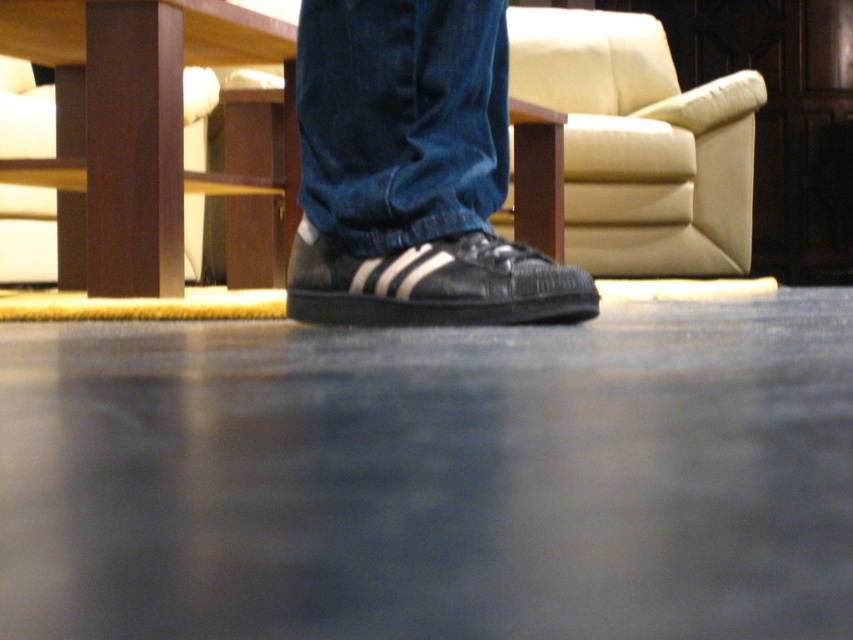
You are a designer creating a 3D model of the living room scene. You need to place the denim at center in your model. What are the coordinates for its position?

The coordinates for the denim at center are at point [401,118].

You are designing a layout for a living room and need to place the denim at center and the beige leather armchair at upper center. Given their widths, which object should you allocate more space for in your design plan?

The beige leather armchair at upper center requires more space in the design plan because its width is greater than the denim at center.

You are a delivery person who needs to place a small package on the floor near the brown wood stool at lower left and the black leather shoe at center. Can you place the package directly between them without moving either object?

The brown wood stool at lower left is above the black leather shoe at center, so placing the package directly between them would require placing it under the stool, but since the stool is above the shoe, there might not be enough space between them for the package. It might be better to place it next to one of the objects instead.